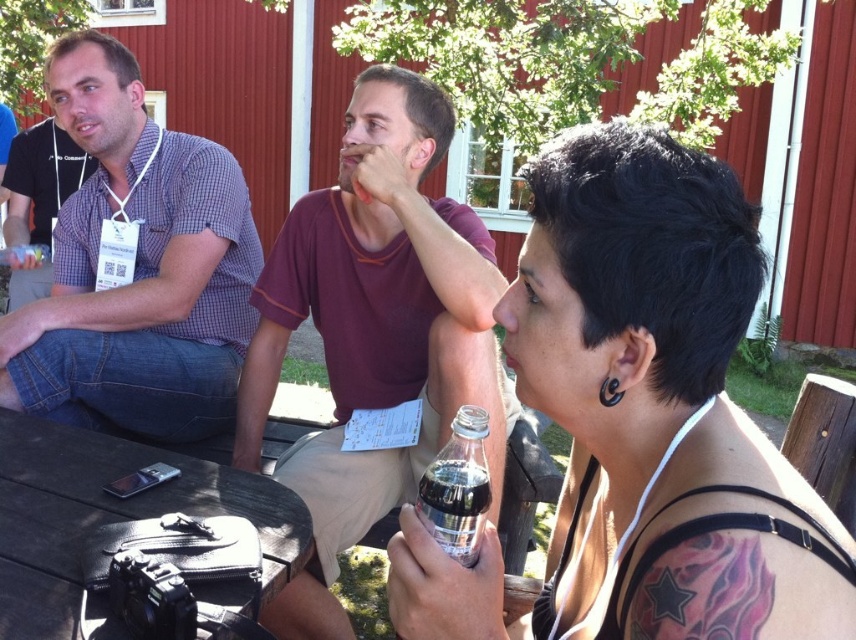
Does checkered fabric shirt at left appear on the left side of clear glass bottle at center?

Yes, checkered fabric shirt at left is to the left of clear glass bottle at center.

Is checkered fabric shirt at left taller than clear glass bottle at center?

Yes.

The height and width of the screenshot is (640, 856). What do you see at coordinates (135, 268) in the screenshot? I see `checkered fabric shirt at left` at bounding box center [135, 268].

This screenshot has height=640, width=856. What are the coordinates of `checkered fabric shirt at left` in the screenshot? It's located at (135, 268).

Is black wood table at lower left wider than clear glass bottle at center?

Yes, black wood table at lower left is wider than clear glass bottle at center.

Which is more to the left, black wood table at lower left or clear glass bottle at center?

From the viewer's perspective, black wood table at lower left appears more on the left side.

Where is `black wood table at lower left`? Image resolution: width=856 pixels, height=640 pixels. black wood table at lower left is located at coordinates (110, 515).

Where is `black wood table at lower left`? This screenshot has height=640, width=856. black wood table at lower left is located at coordinates (110, 515).

Is clear plastic bottle at center shorter than clear glass bottle at center?

No, clear plastic bottle at center is not shorter than clear glass bottle at center.

Is point (634, 436) closer to viewer compared to point (415, 509)?

No, it is not.

Between point (575, 461) and point (461, 504), which one is positioned behind?

The point (575, 461) is behind.

The height and width of the screenshot is (640, 856). Identify the location of clear plastic bottle at center. (642, 420).